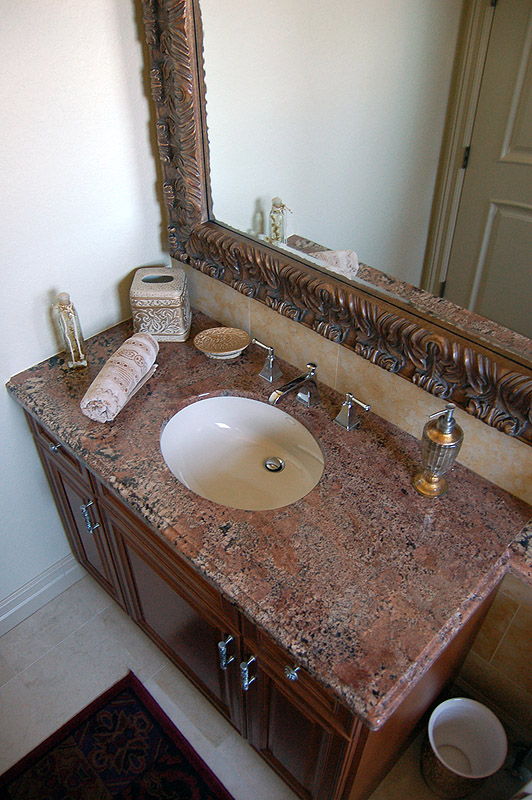
Where is `decorative gold hand soap dispenser`? The height and width of the screenshot is (800, 532). decorative gold hand soap dispenser is located at coordinates (440, 446).